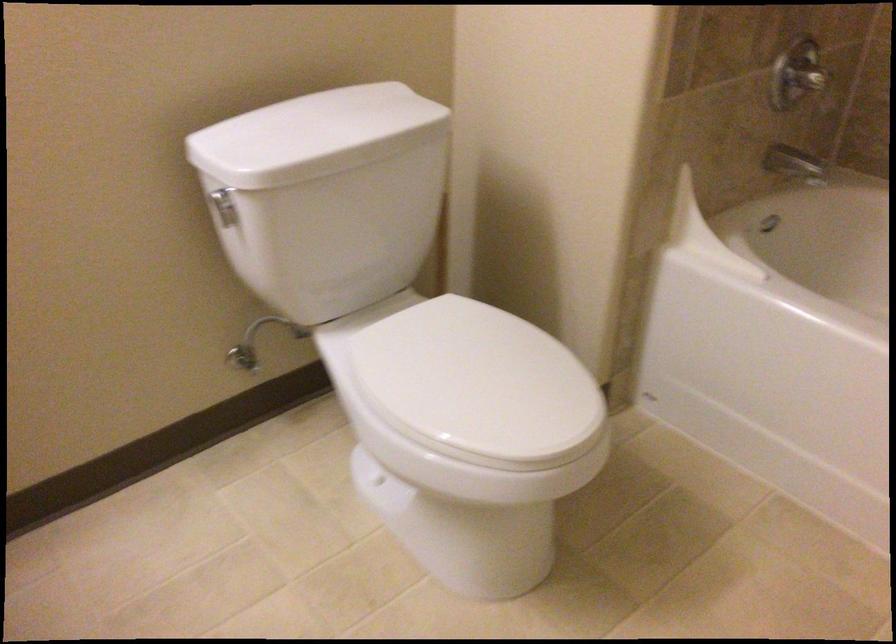
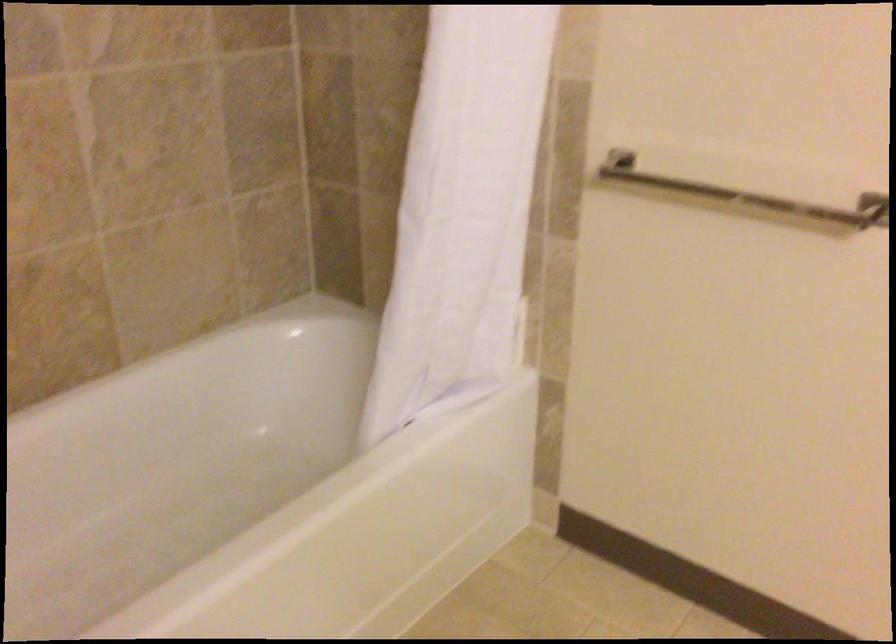
Based on the continuous images, in which direction is the camera rotating?

The camera rotated toward right-down.